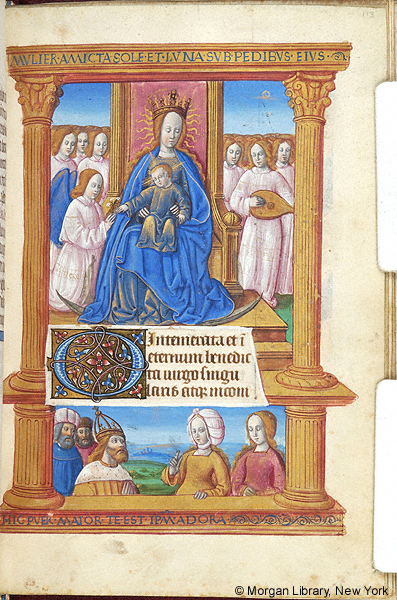
You are a GUI agent. You are given a task and a screenshot of the screen. Output one action in this format:
    pyautogui.click(x=<x>, y=<y>)
    Task: Click on the back of throne
    
    Given the screenshot: What is the action you would take?
    pyautogui.click(x=200, y=141)